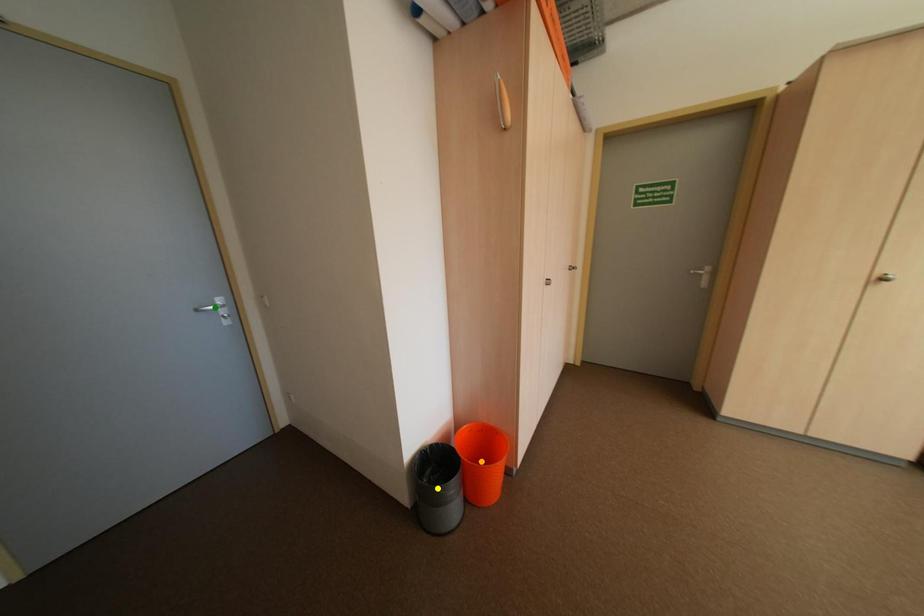
Order these from nearest to farthest:
A) orange point
B) yellow point
C) green point

green point, orange point, yellow point